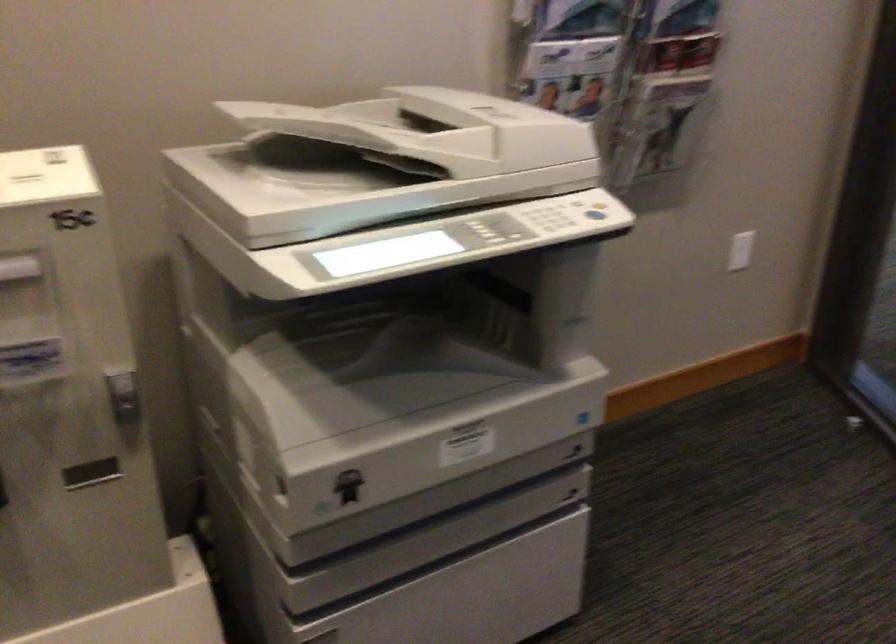
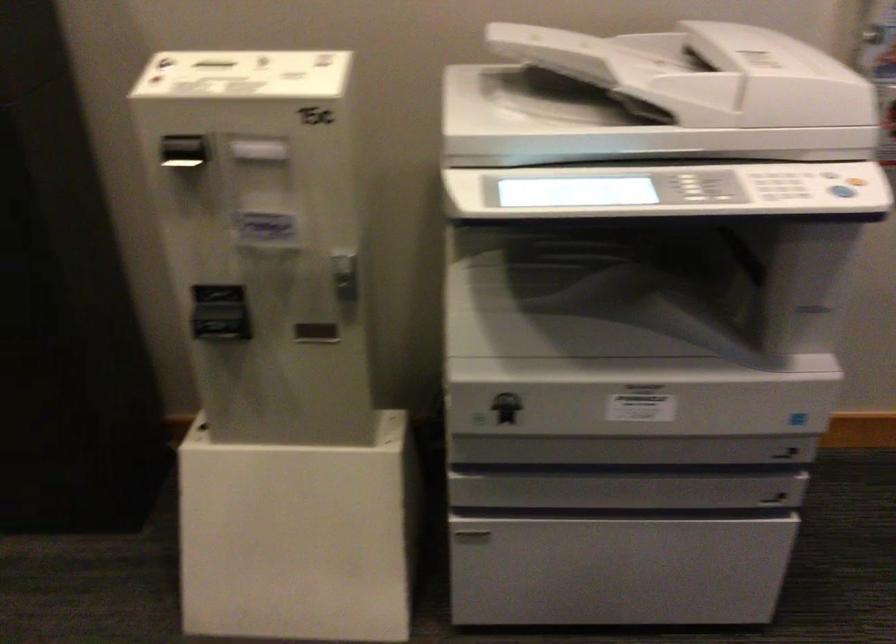
In the second image, find the point that corresponds to the point at 597,214 in the first image.

(841, 191)